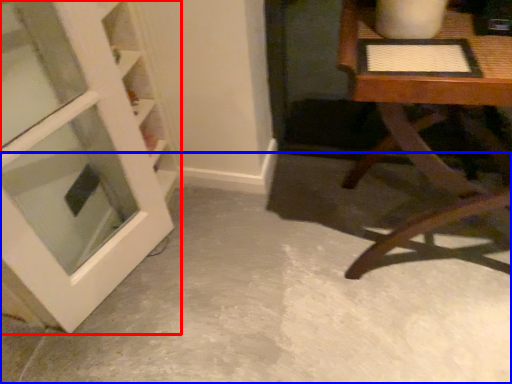
Question: Which object appears closest to the camera in this image, door (highlighted by a red box) or concrete (highlighted by a blue box)?

Choices:
 (A) door
 (B) concrete

Answer: (A)